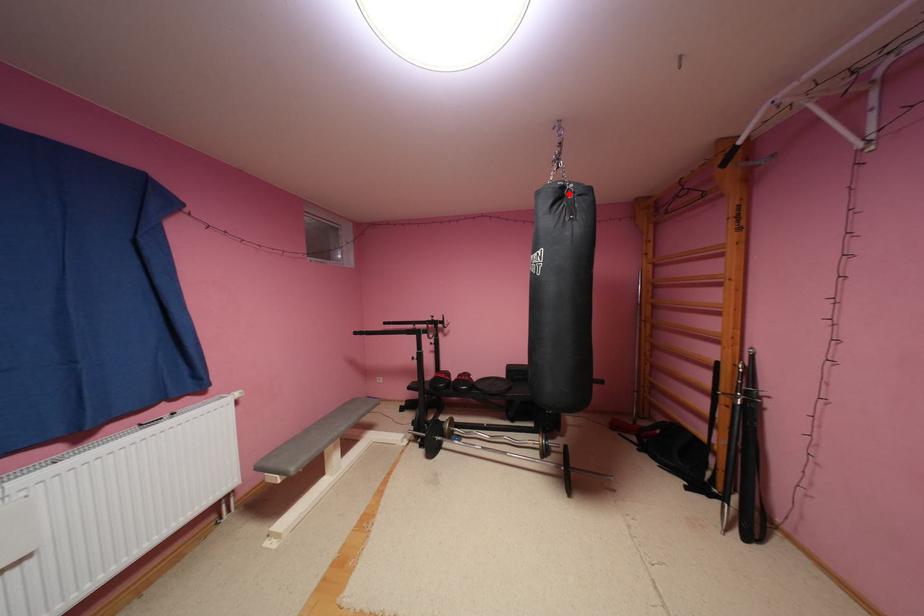
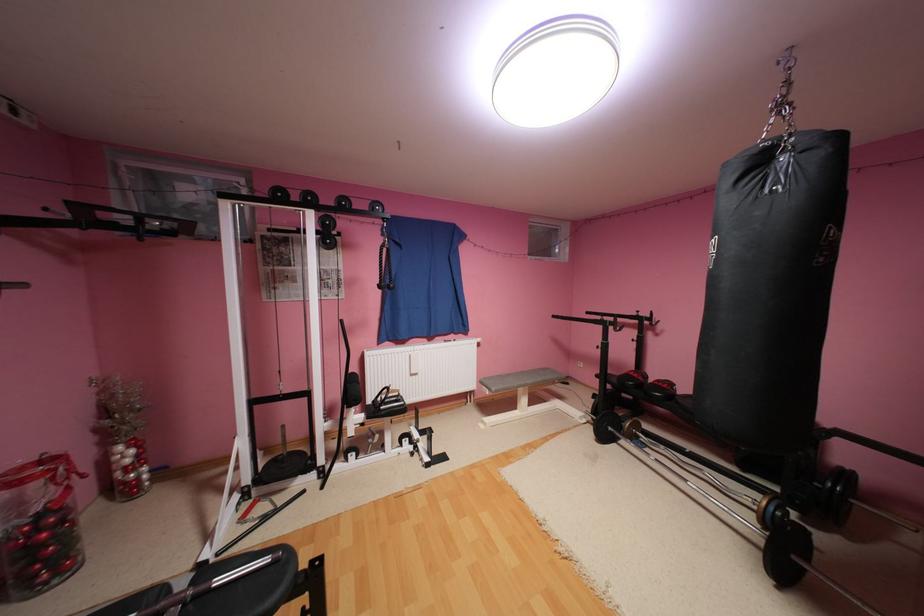
Where in the second image is the point corresponding to the highlighted location from the first image?

(769, 161)